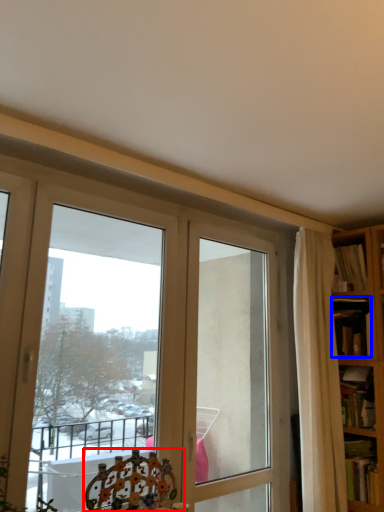
Question: Which object appears closest to the camera in this image, chair (highlighted by a red box) or book (highlighted by a blue box)?

Choices:
 (A) chair
 (B) book

Answer: (A)